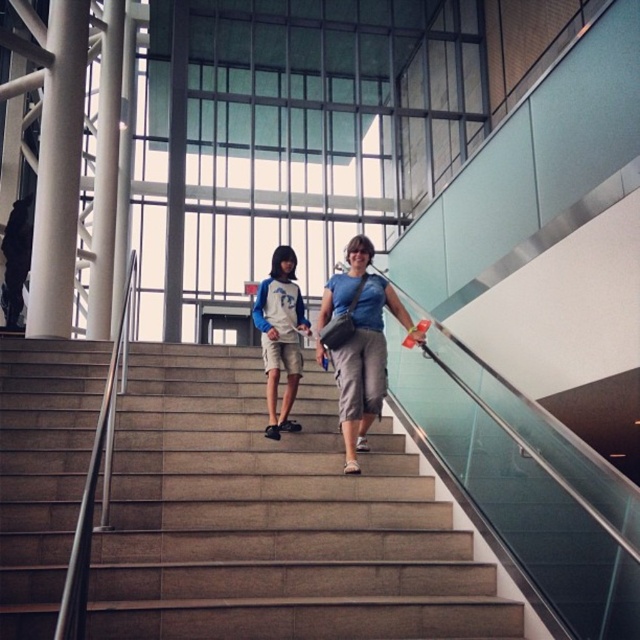
You are an interior designer assessing the space between two objects in the scene. The blue denim shorts at center and the blue and white jersey at center are both placed in the central area. Which object has a greater width?

The blue denim shorts at center has a greater width than the blue and white jersey at center according to the description provided.